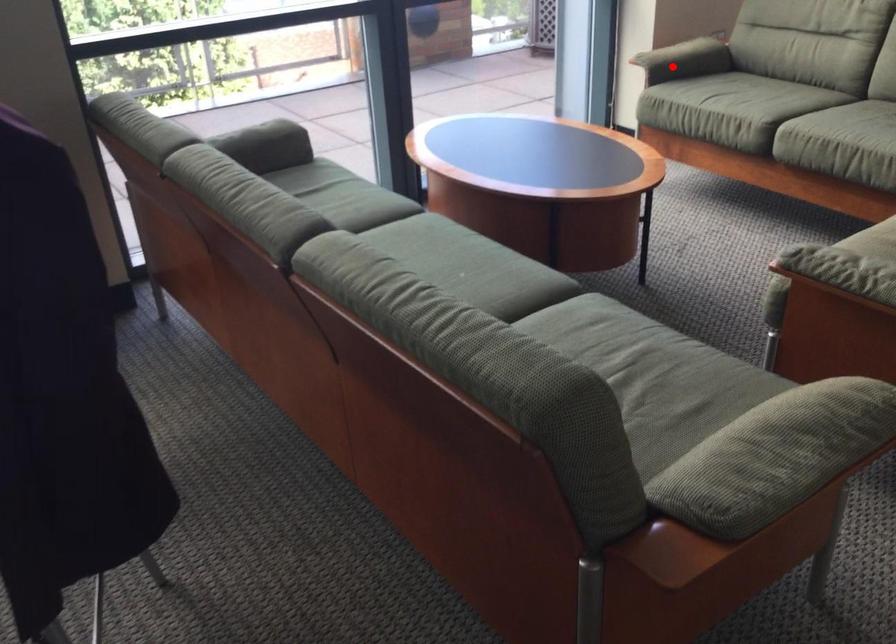
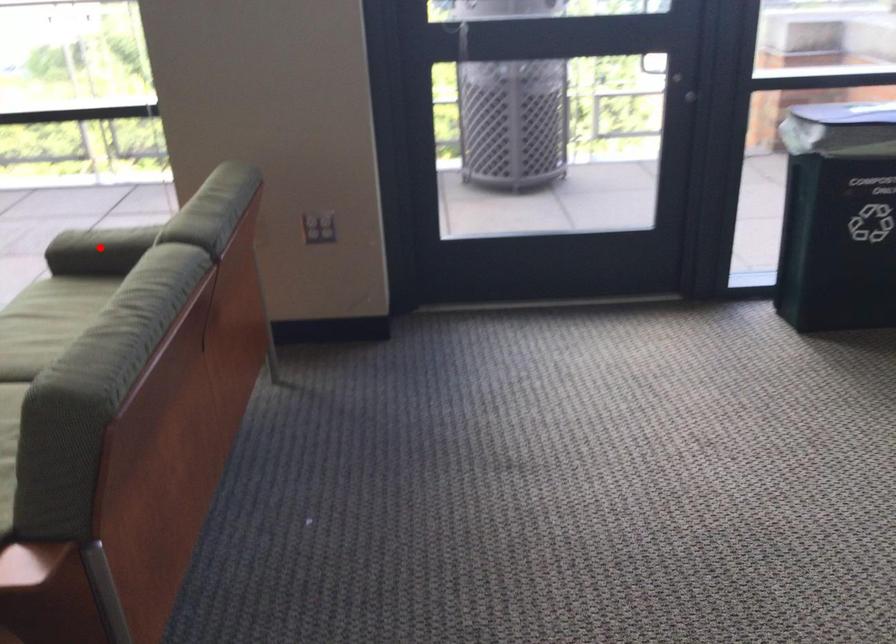
I am providing you with two images of the same scene from different viewpoints. A red point is marked on the first image and another point is marked on the second image. Does the point marked in image1 correspond to the same location as the one in image2?

Yes